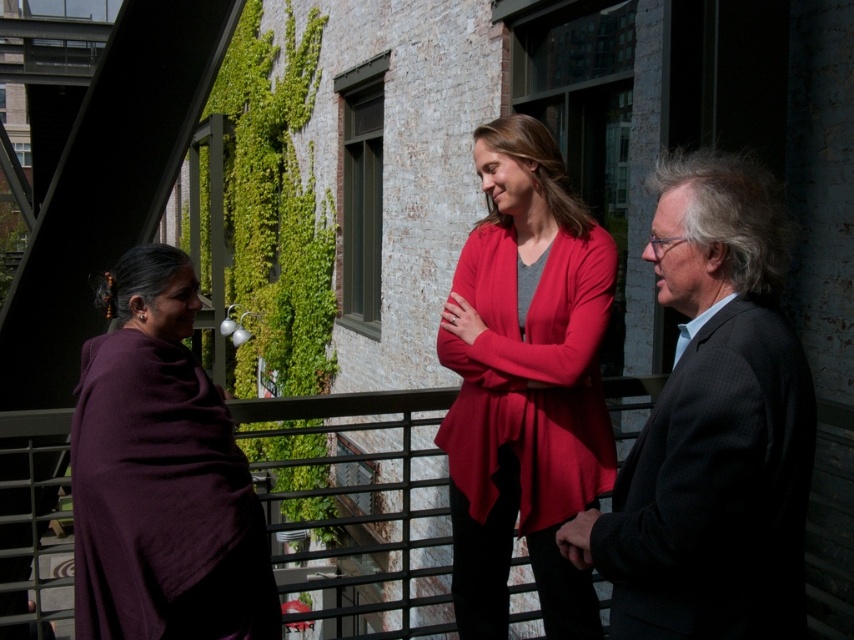
You are a photographer trying to capture a candid shot of the two people wearing the matte red cardigan at center and the purple woolen shawl at left. Since you want to include both subjects in the frame, which one should you position closer to the camera to ensure both are fully visible?

The matte red cardigan at center is positioned on the right side of the purple woolen shawl at left. To include both subjects fully in the frame, position the purple woolen shawl at left closer to the camera since it is already to the left of the matte red cardigan at center, allowing the photographer to capture both without cropping either out.

You are a photographer trying to capture a group photo of the dark gray suit at right and the matte red cardigan at center. If you want to ensure both subjects are in focus, which one should you focus on first to account for their height difference?

The matte red cardigan at center is taller than the dark gray suit at right, so you should focus on the matte red cardigan at center first to ensure both are in focus.

You are organizing a photoshoot and need to ensure that the dark gray suit at right and the purple woolen shawl at left are visible in the frame. Based on their sizes, which one might require more careful framing to avoid being cut off?

The purple woolen shawl at left requires more careful framing because it occupies more space than the dark gray suit at right, making it more likely to extend towards the edges of the frame.